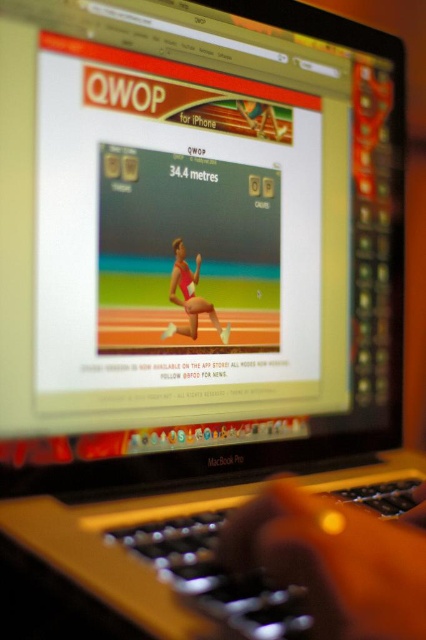
You are trying to play the game QWOP on your MacBook Pro. You see the black plastic keyboard at lower center and the matte pink swimsuit at center. Which object is located to the right of the other?

The black plastic keyboard at lower center is positioned on the right side of matte pink swimsuit at center, so it is located to the right of the matte pink swimsuit at center.

You are playing the game QWOP on your MacBook Pro and notice two items on the screen. You see the black plastic keyboard at lower center and the matte pink swimsuit at center. Which object is located lower on the screen?

The black plastic keyboard at lower center is positioned under the matte pink swimsuit at center, so it is located lower on the screen.

You are trying to reach the matte pink swimsuit at center from the black plastic keyboard at lower center. Which direction should you move towards?

The black plastic keyboard at lower center is closer to the viewer than the matte pink swimsuit at center, so you should move forward to reach the matte pink swimsuit at center.